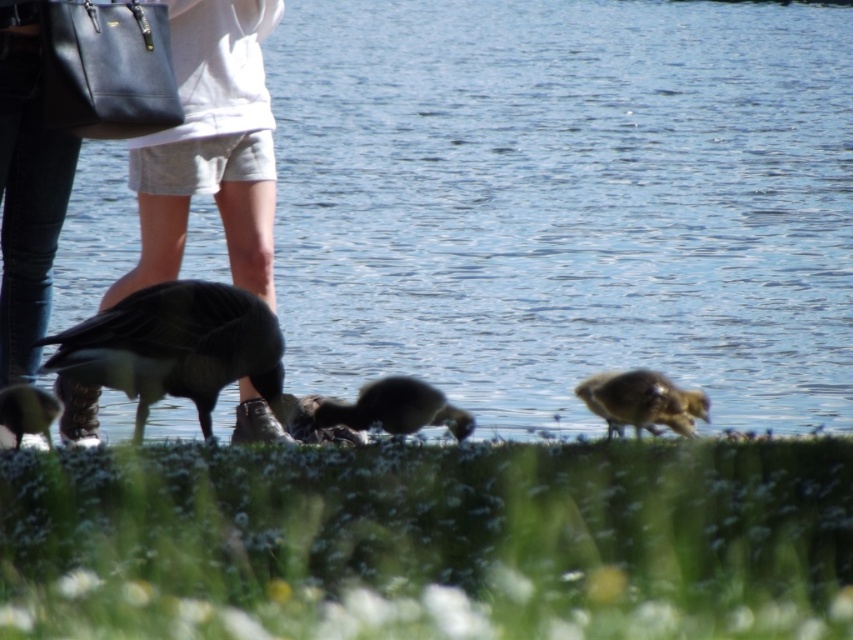
Question: Which object appears closest to the camera in this image?

Choices:
 (A) dark gray feathers duck at lower left
 (B) dark brown feathers at center

Answer: (A)

Question: Is matte black bag at lower left bigger than dark gray feathers duck at lower left?

Choices:
 (A) yes
 (B) no

Answer: (A)

Question: Which point appears closest to the camera in this image?

Choices:
 (A) (12, 404)
 (B) (224, 342)
 (C) (630, 68)

Answer: (A)

Question: Can you confirm if dark brown feathers at center is positioned to the left of brown fuzzy duckling at lower right?

Choices:
 (A) no
 (B) yes

Answer: (B)

Question: Considering the relative positions of dark gray feathers duck at lower left and dark brown feathers at lower left in the image provided, where is dark gray feathers duck at lower left located with respect to dark brown feathers at lower left?

Choices:
 (A) left
 (B) right

Answer: (B)

Question: Among these objects, which one is farthest from the camera?

Choices:
 (A) clear blue water at center
 (B) matte black bag at lower left

Answer: (B)